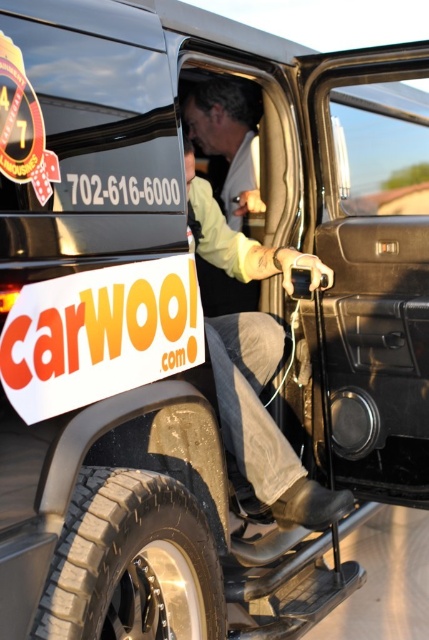
Question: Is black rubber tire at lower left to the right of denim pants at lower center from the viewer's perspective?

Choices:
 (A) yes
 (B) no

Answer: (B)

Question: Which of the following is the farthest from the observer?

Choices:
 (A) (218, 580)
 (B) (241, 248)

Answer: (B)

Question: Where is black rubber tire at lower left located in relation to denim pants at lower center in the image?

Choices:
 (A) left
 (B) right

Answer: (A)

Question: Which object appears closest to the camera in this image?

Choices:
 (A) black rubber tire at lower left
 (B) denim pants at lower center

Answer: (A)

Question: Does black rubber tire at lower left appear on the right side of denim pants at lower center?

Choices:
 (A) yes
 (B) no

Answer: (B)